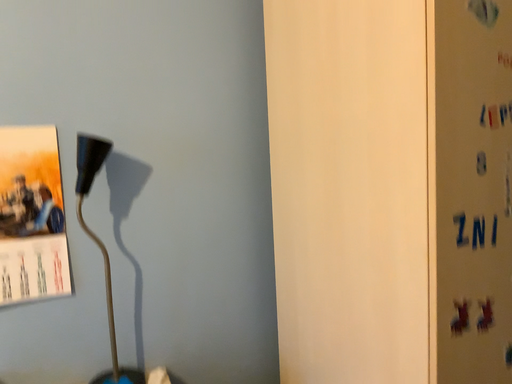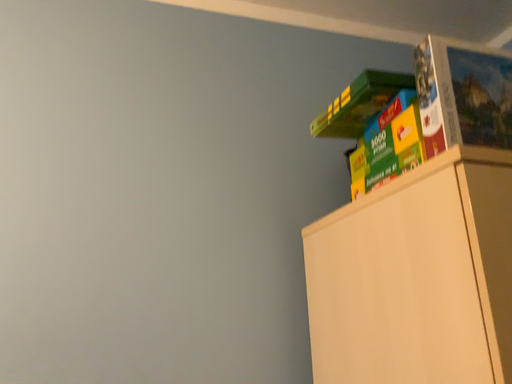
Question: How did the camera likely rotate when shooting the video?

Choices:
 (A) rotated downward
 (B) rotated upward

Answer: (B)